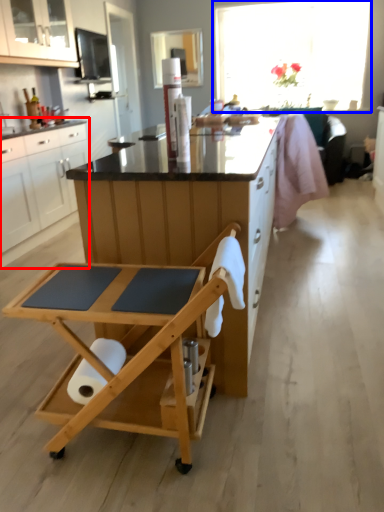
Question: Which object appears closest to the camera in this image, cabinetry (highlighted by a red box) or window (highlighted by a blue box)?

Choices:
 (A) cabinetry
 (B) window

Answer: (A)